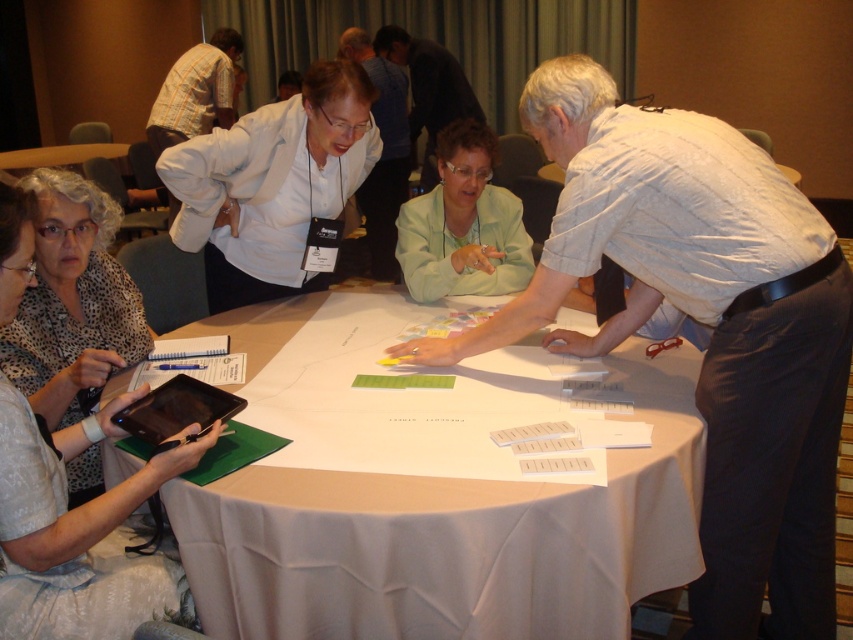
Question: Considering the real-world distances, which object is closest to the white striped shirt at upper right?

Choices:
 (A) striped shirt at upper left
 (B) green matte jacket at center

Answer: (B)

Question: Is white paper at center to the left of green matte jacket at center from the viewer's perspective?

Choices:
 (A) no
 (B) yes

Answer: (B)

Question: Which point is farther to the camera?

Choices:
 (A) white striped shirt at upper right
 (B) matte black tablet at lower left
 (C) black glossy tablet at lower left

Answer: (A)

Question: Does matte black tablet at lower left appear over striped shirt at upper left?

Choices:
 (A) yes
 (B) no

Answer: (B)

Question: Is white matte shirt at upper center in front of leopard print blouse at lower left?

Choices:
 (A) no
 (B) yes

Answer: (A)

Question: Which object appears closest to the camera in this image?

Choices:
 (A) matte black tablet at lower left
 (B) striped shirt at upper left
 (C) leopard print blouse at lower left

Answer: (A)